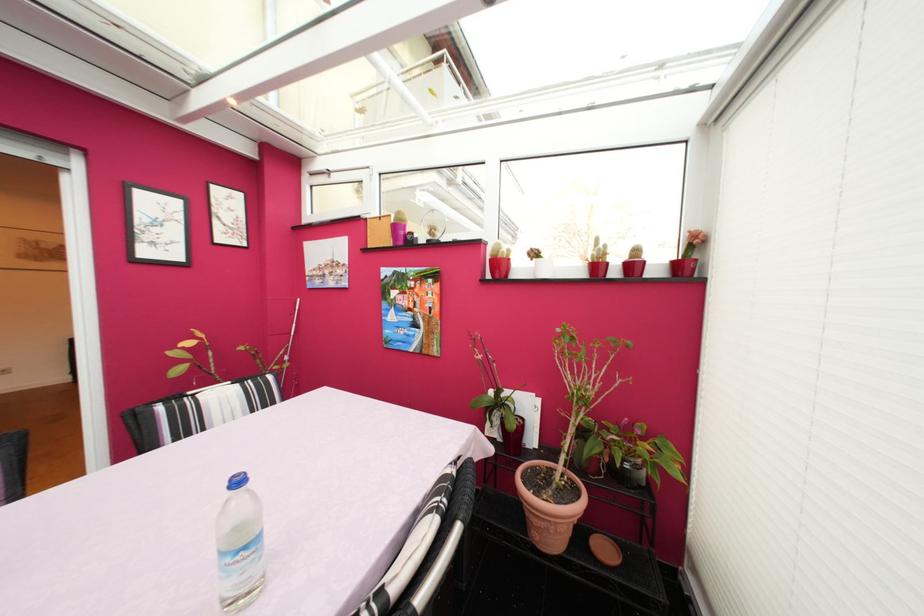
Where is `small round mirror`? Image resolution: width=924 pixels, height=616 pixels. small round mirror is located at coordinates (432, 225).